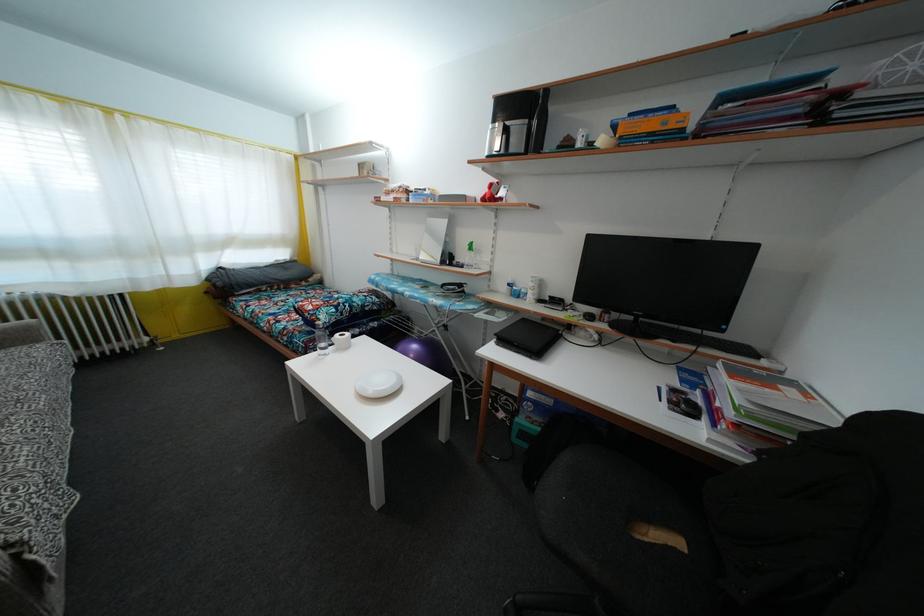
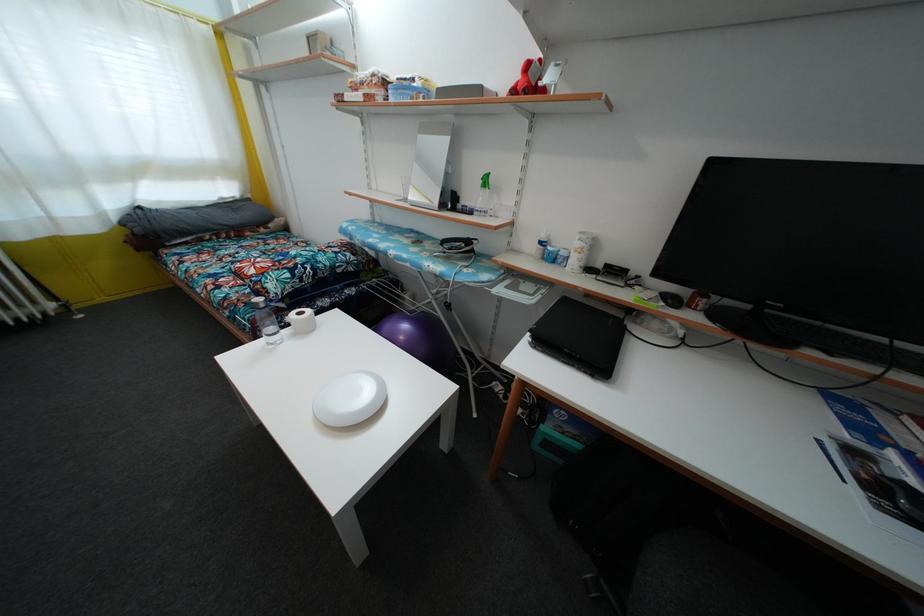
Question: The first image is from the beginning of the video and the second image is from the end. How did the camera likely rotate when shooting the video?

Choices:
 (A) Left
 (B) Right
 (C) Up
 (D) Down

Answer: (D)